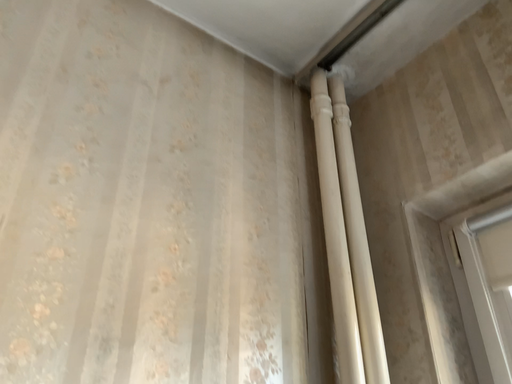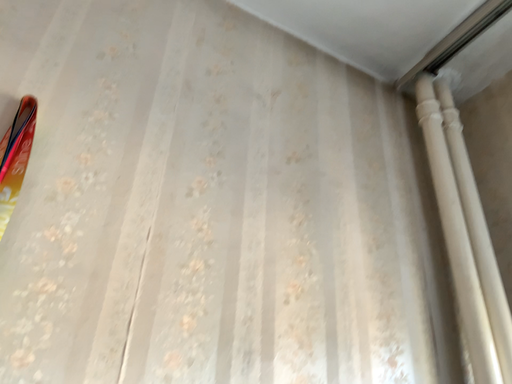
Question: Which way did the camera rotate in the video?

Choices:
 (A) rotated right
 (B) rotated left

Answer: (B)